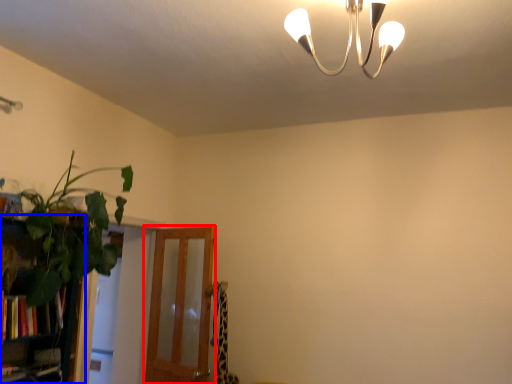
Question: Which object appears closest to the camera in this image, screen door (highlighted by a red box) or bookshelf (highlighted by a blue box)?

Choices:
 (A) screen door
 (B) bookshelf

Answer: (B)